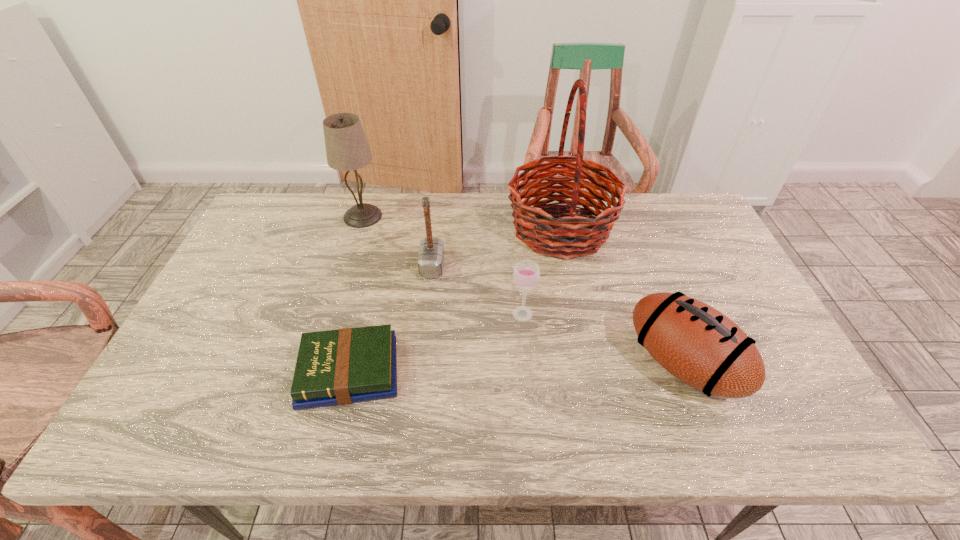
The image size is (960, 540). In order to click on free space between the lampshade and the tallest object in this screenshot , I will do `click(462, 223)`.

Where is `unoccupied area between the football (American) and the hammer`? The image size is (960, 540). unoccupied area between the football (American) and the hammer is located at coordinates (558, 315).

The height and width of the screenshot is (540, 960). I want to click on free spot between the second tallest object and the basket, so click(x=462, y=223).

The height and width of the screenshot is (540, 960). I want to click on blank region between the hammer and the basket, so click(496, 248).

Select which object is the fifth closest to the football (American). Please provide its 2D coordinates. Your answer should be formatted as a tuple, i.e. [(x, y)], where the tuple contains the x and y coordinates of a point satisfying the conditions above.

[(347, 149)]

Image resolution: width=960 pixels, height=540 pixels. I want to click on object that stands as the closest to the basket, so click(x=526, y=274).

Identify the location of vacant space that satisfies the following two spatial constraints: 1. on the front-facing side of the lampshade; 2. on the left side of the football (American). The image size is (960, 540). (318, 363).

Image resolution: width=960 pixels, height=540 pixels. In order to click on free location that satisfies the following two spatial constraints: 1. on the striking surface of the football (American); 2. on the left side of the third object from left to right in this screenshot , I will do `click(421, 363)`.

Find the location of a particular element. vacant space that satisfies the following two spatial constraints: 1. on the front-facing side of the book; 2. on the right side of the second tallest object is located at coordinates (315, 372).